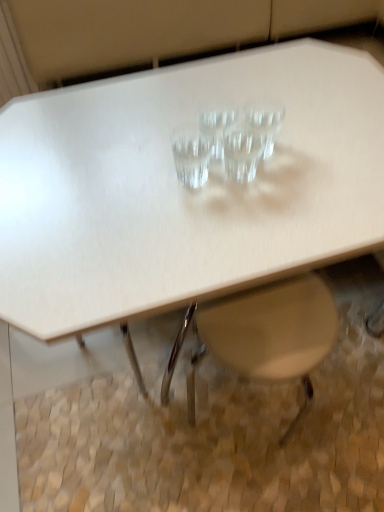
Question: Which direction should I rotate to look at transparent glass martini glass at center, placed as the third martini glass when sorted from right to left?

Choices:
 (A) right
 (B) left

Answer: (A)

Question: Can you confirm if transparent glass martini glass at center, which is the second martini glass from left to right, is positioned to the left of transparent glass martini at center, which is the 2th martini glass from right to left?

Choices:
 (A) yes
 (B) no

Answer: (A)

Question: Does transparent glass martini glass at center, which is the second martini glass from left to right, have a greater height compared to transparent glass martini at center, which is the 2th martini glass from right to left?

Choices:
 (A) yes
 (B) no

Answer: (A)

Question: Is transparent glass martini glass at center, which is the second martini glass from left to right, positioned far away from transparent glass martini at center, which is the 2th martini glass from right to left?

Choices:
 (A) no
 (B) yes

Answer: (A)

Question: Is transparent glass martini glass at center, which is the second martini glass from left to right, to the right of transparent glass martini at center, which is the 3th martini glass in left-to-right order, from the viewer's perspective?

Choices:
 (A) yes
 (B) no

Answer: (B)

Question: Can you confirm if transparent glass martini glass at center, placed as the third martini glass when sorted from right to left, is bigger than transparent glass martini at center, which is the 3th martini glass in left-to-right order?

Choices:
 (A) no
 (B) yes

Answer: (B)

Question: From the image's perspective, is transparent glass martini glass at center, placed as the third martini glass when sorted from right to left, on transparent glass martini at center, which is the 3th martini glass in left-to-right order?

Choices:
 (A) yes
 (B) no

Answer: (A)

Question: Is white plastic swivel chair at lower center smaller than transparent glass martini at center, which is the 3th martini glass in left-to-right order?

Choices:
 (A) no
 (B) yes

Answer: (A)

Question: Is white plastic swivel chair at lower center positioned before transparent glass martini at center, which is the 2th martini glass from right to left?

Choices:
 (A) no
 (B) yes

Answer: (A)

Question: Does white plastic swivel chair at lower center have a greater width compared to transparent glass martini at center, which is the 3th martini glass in left-to-right order?

Choices:
 (A) yes
 (B) no

Answer: (A)

Question: Is white plastic swivel chair at lower center surrounding transparent glass martini at center, which is the 3th martini glass in left-to-right order?

Choices:
 (A) yes
 (B) no

Answer: (B)

Question: Is the surface of white plastic swivel chair at lower center in direct contact with transparent glass martini at center, which is the 3th martini glass in left-to-right order?

Choices:
 (A) no
 (B) yes

Answer: (A)

Question: Is white plastic swivel chair at lower center positioned with its back to transparent glass martini at center, which is the 2th martini glass from right to left?

Choices:
 (A) no
 (B) yes

Answer: (A)

Question: Is white plastic swivel chair at lower center shorter than transparent glass martini glass at center, marked as the fourth martini glass in a right-to-left arrangement?

Choices:
 (A) yes
 (B) no

Answer: (B)